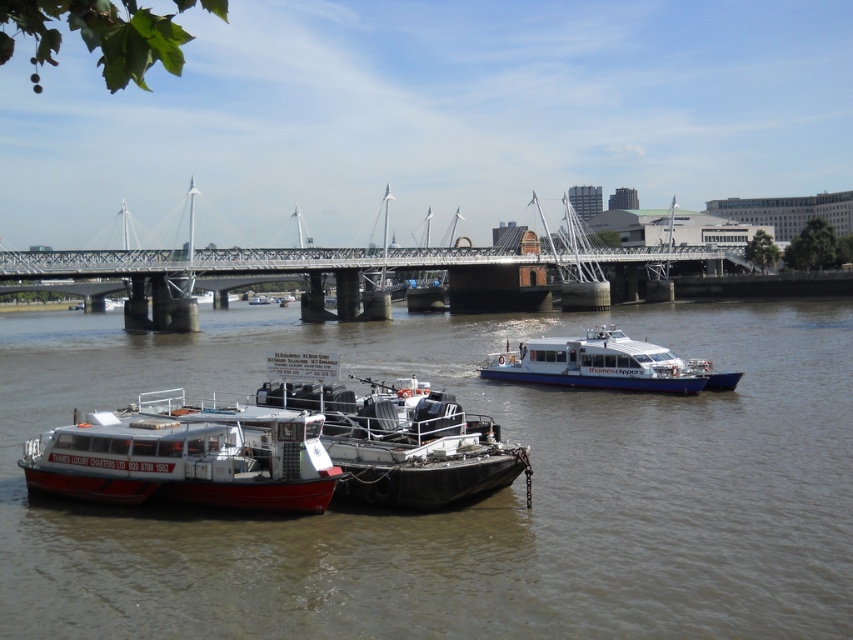
Can you confirm if metallic bridge at center is wider than white matte boat at lower left?

Indeed, metallic bridge at center has a greater width compared to white matte boat at lower left.

Is point (108, 264) behind point (59, 449)?

Yes, it is.

Where is `metallic bridge at center`? The image size is (853, 640). metallic bridge at center is located at coordinates (361, 273).

The height and width of the screenshot is (640, 853). I want to click on metallic bridge at center, so click(x=361, y=273).

Looking at this image, is brown matte water at center thinner than white matte boat at lower left?

No.

Is point (111, 579) in front of point (263, 508)?

Yes, point (111, 579) is in front of point (263, 508).

Image resolution: width=853 pixels, height=640 pixels. I want to click on brown matte water at center, so click(471, 502).

Can you confirm if brown matte water at center is taller than metallic bridge at center?

Incorrect, brown matte water at center's height is not larger of metallic bridge at center's.

Between brown matte water at center and metallic bridge at center, which one appears on the left side from the viewer's perspective?

metallic bridge at center is more to the left.

What do you see at coordinates (471, 502) in the screenshot? I see `brown matte water at center` at bounding box center [471, 502].

I want to click on brown matte water at center, so click(471, 502).